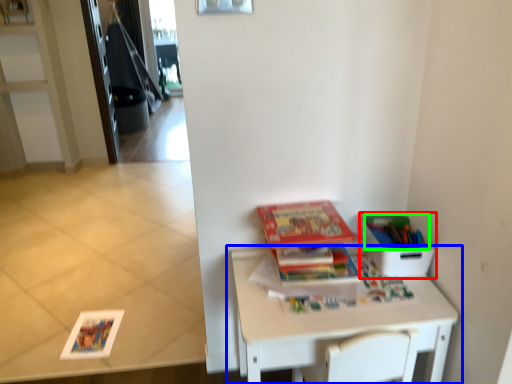
Question: Which object is positioned closest to cardboard box (highlighted by a red box)? Select from table (highlighted by a blue box) and book (highlighted by a green box).

Choices:
 (A) table
 (B) book

Answer: (B)